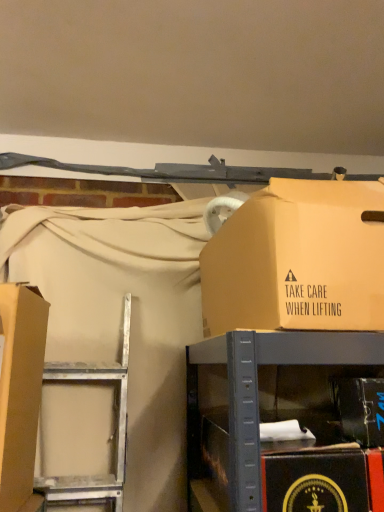
Question: Is metallic cardboard box at center not within matte cardboard box at upper right, the 2th box viewed from the right?

Choices:
 (A) no
 (B) yes

Answer: (B)

Question: Does metallic cardboard box at center have a greater width compared to matte cardboard box at upper right, arranged as the second box when viewed from the left?

Choices:
 (A) no
 (B) yes

Answer: (B)

Question: Can you confirm if metallic cardboard box at center is smaller than matte cardboard box at upper right, arranged as the second box when viewed from the left?

Choices:
 (A) yes
 (B) no

Answer: (A)

Question: Does metallic cardboard box at center come behind matte cardboard box at upper right, arranged as the second box when viewed from the left?

Choices:
 (A) no
 (B) yes

Answer: (A)

Question: Does metallic cardboard box at center have a lesser height compared to matte cardboard box at upper right, the 2th box viewed from the right?

Choices:
 (A) no
 (B) yes

Answer: (B)

Question: Relative to matte cardboard box at left, arranged as the 3th box when viewed from the right, is metallic cardboard box at center in front or behind?

Choices:
 (A) front
 (B) behind

Answer: (A)

Question: Is metallic cardboard box at center bigger or smaller than matte cardboard box at left, acting as the first box starting from the left?

Choices:
 (A) small
 (B) big

Answer: (B)

Question: From the image's perspective, is metallic cardboard box at center positioned above or below matte cardboard box at left, arranged as the 3th box when viewed from the right?

Choices:
 (A) above
 (B) below

Answer: (B)

Question: Would you say metallic cardboard box at center is to the left or to the right of matte cardboard box at left, arranged as the 3th box when viewed from the right, in the picture?

Choices:
 (A) right
 (B) left

Answer: (A)

Question: Considering their positions, is metallic black box at lower right, the 1th box positioned from the right, located in front of or behind metallic cardboard box at center?

Choices:
 (A) front
 (B) behind

Answer: (B)

Question: Visually, is metallic black box at lower right, the 1th box positioned from the right, positioned to the left or to the right of metallic cardboard box at center?

Choices:
 (A) right
 (B) left

Answer: (A)

Question: From the image's perspective, is metallic black box at lower right, the 1th box positioned from the right, located above or below metallic cardboard box at center?

Choices:
 (A) below
 (B) above

Answer: (B)

Question: Is metallic black box at lower right, arranged as the third box when viewed from the left, wider or thinner than metallic cardboard box at center?

Choices:
 (A) thin
 (B) wide

Answer: (A)

Question: Is matte cardboard box at upper right, the 2th box viewed from the right, situated inside metallic black box at lower right, the 1th box positioned from the right, or outside?

Choices:
 (A) outside
 (B) inside

Answer: (A)

Question: Is matte cardboard box at upper right, the 2th box viewed from the right, in front of or behind metallic black box at lower right, arranged as the third box when viewed from the left, in the image?

Choices:
 (A) behind
 (B) front

Answer: (B)